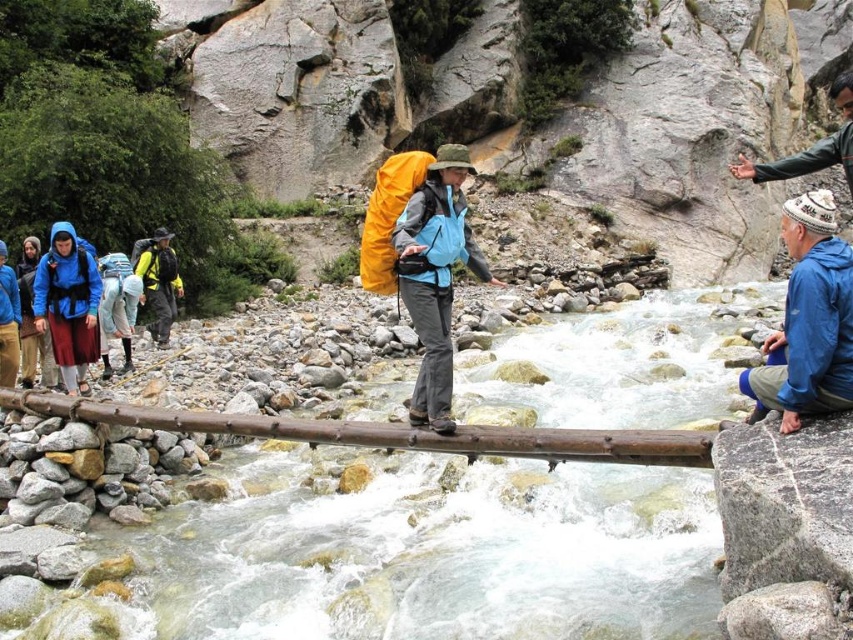
Can you confirm if brown wooden log at center is positioned to the left of matte blue jacket at left?

No, brown wooden log at center is not to the left of matte blue jacket at left.

Between brown wooden log at center and matte blue jacket at left, which one has more height?

With more height is brown wooden log at center.

This screenshot has height=640, width=853. What are the coordinates of `brown wooden log at center` in the screenshot? It's located at (430, 552).

From the picture: Does matte blue jacket at center appear on the right side of matte blue jacket at left?

Yes, matte blue jacket at center is to the right of matte blue jacket at left.

In the scene shown: Is matte blue jacket at center to the left of matte blue jacket at left from the viewer's perspective?

No, matte blue jacket at center is not to the left of matte blue jacket at left.

This screenshot has width=853, height=640. What do you see at coordinates (434, 276) in the screenshot?
I see `matte blue jacket at center` at bounding box center [434, 276].

The image size is (853, 640). What are the coordinates of `matte blue jacket at center` in the screenshot? It's located at (434, 276).

Looking at this image, which of these two, brown wooden log at center or matte blue jacket at center, stands shorter?

matte blue jacket at center

Does brown wooden log at center appear under matte blue jacket at center?

Yes, brown wooden log at center is below matte blue jacket at center.

Is point (711, 579) positioned after point (451, 211)?

No.

Find the location of a particular element. The height and width of the screenshot is (640, 853). brown wooden log at center is located at coordinates (430, 552).